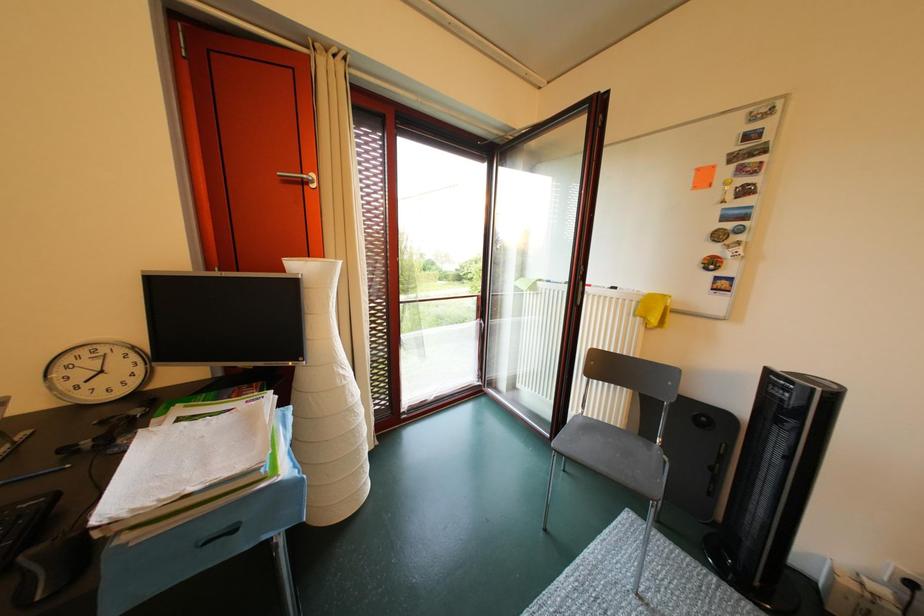
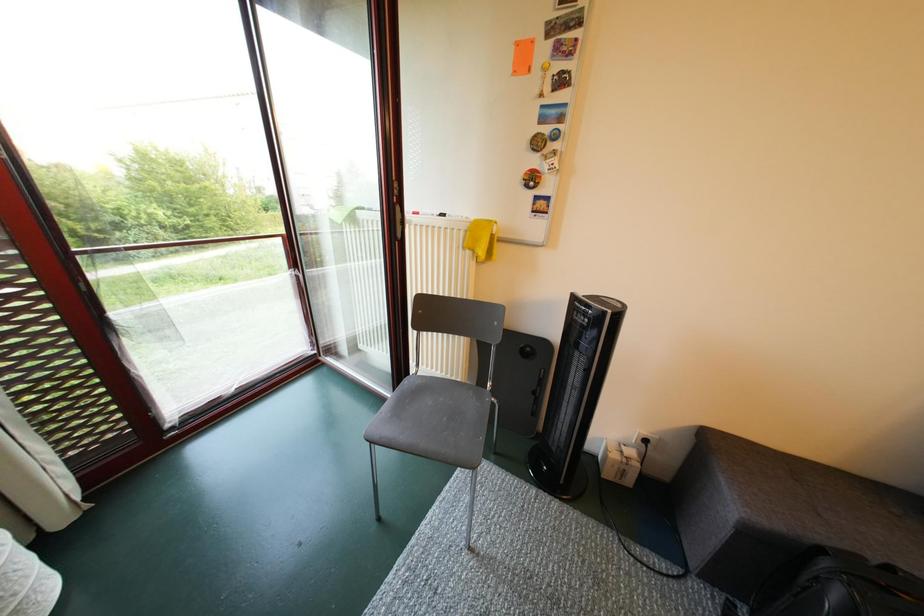
Question: Based on the continuous images, in which direction is the camera rotating? Reply with the corresponding letter.

Choices:
 (A) Left
 (B) Right
 (C) Up
 (D) Down

Answer: (B)